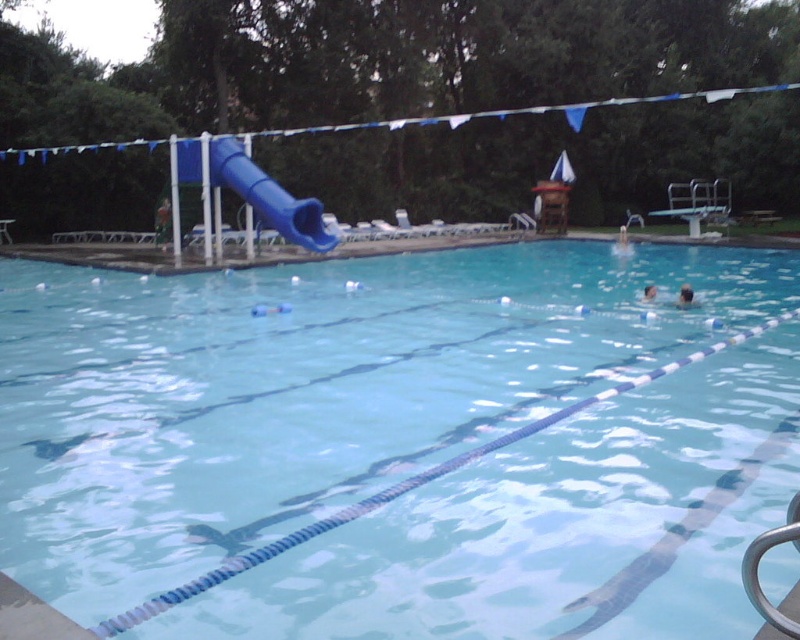
Looking at this image, you are standing at the edge of the pool and see two people with smooth skin heads in the water. Which one is positioned lower in the pool, the smooth skin head at upper right or the smooth skin head at right?

The smooth skin head at upper right is positioned lower in the pool since it is below the smooth skin head at right.